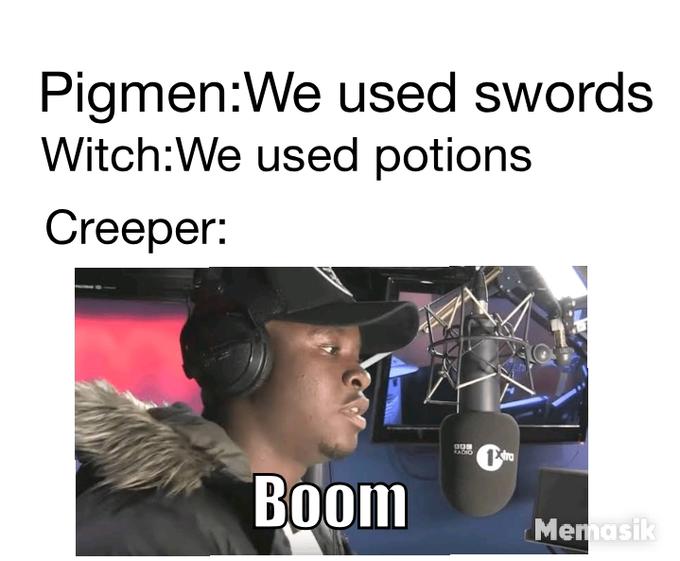
Image resolution: width=680 pixels, height=561 pixels. I want to click on radio, so click(x=408, y=445).